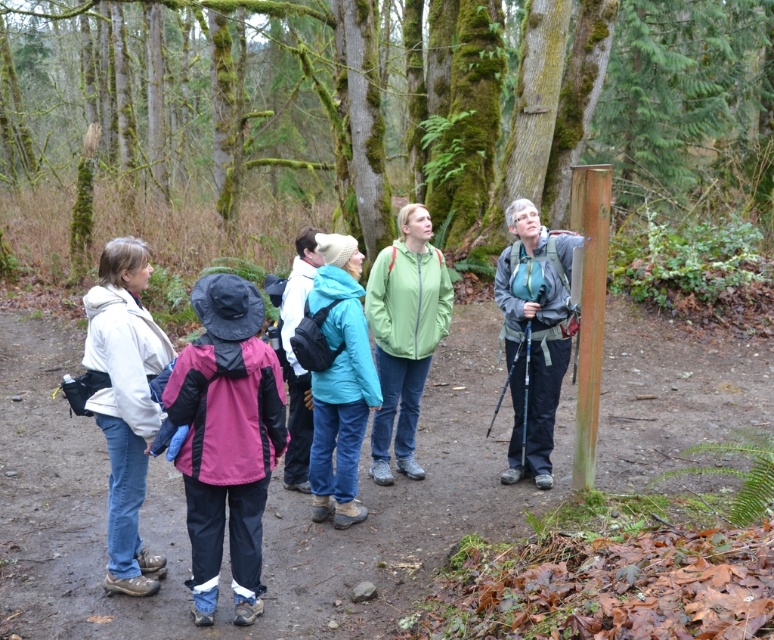
Question: Which point is closer to the camera?

Choices:
 (A) smooth wooden post at center
 (B) matte black backpack at center
 (C) matte white jacket at left
 (D) green matte jacket at center

Answer: (B)

Question: Can you confirm if gray-green fabric backpack at right is positioned to the right of green matte jacket at center?

Choices:
 (A) no
 (B) yes

Answer: (B)

Question: Which object appears farthest from the camera in this image?

Choices:
 (A) gray-green fabric backpack at right
 (B) green matte jacket at center
 (C) smooth wooden post at center
 (D) teal matte jacket at center

Answer: (C)

Question: Does matte black backpack at center have a greater width compared to green matte jacket at center?

Choices:
 (A) yes
 (B) no

Answer: (A)

Question: Can you confirm if matte white jacket at left is positioned to the right of gray-green fabric backpack at right?

Choices:
 (A) yes
 (B) no

Answer: (B)

Question: Which object is the closest to the smooth wooden post at center?

Choices:
 (A) matte white jacket at left
 (B) gray-green fabric backpack at right

Answer: (B)